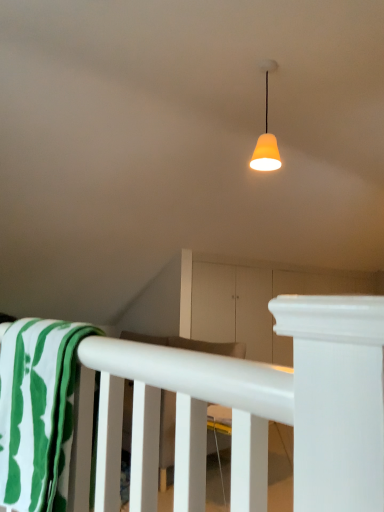
Locate an element on the screen. The image size is (384, 512). white matte rail at lower center is located at coordinates (256, 410).

The image size is (384, 512). What do you see at coordinates (38, 411) in the screenshot? I see `green striped fabric at lower left` at bounding box center [38, 411].

This screenshot has height=512, width=384. Describe the element at coordinates (266, 135) in the screenshot. I see `matte orange lampshade at upper center` at that location.

Where is `white matte rail at lower center`? This screenshot has height=512, width=384. white matte rail at lower center is located at coordinates (256, 410).

From the image's perspective, which is above, matte orange lampshade at upper center or green striped fabric at lower left?

matte orange lampshade at upper center is shown above in the image.

Identify the location of lamp on the right of green striped fabric at lower left. (266, 135).

Is green striped fabric at lower left at the back of matte orange lampshade at upper center?

That's not correct — matte orange lampshade at upper center is not looking away from green striped fabric at lower left.

Is the position of matte orange lampshade at upper center more distant than that of green striped fabric at lower left?

That is True.

In the image, there is a green striped fabric at lower left. Identify the location of rail below it (from the image's perspective). (256, 410).

From a real-world perspective, is white matte rail at lower center over green striped fabric at lower left?

No, from a real-world perspective, white matte rail at lower center is not over green striped fabric at lower left

Is white matte rail at lower center at the right side of green striped fabric at lower left?

Yes.

Is the position of white matte rail at lower center less distant than that of green striped fabric at lower left?

No, white matte rail at lower center is further to the viewer.

Could you tell me if white matte rail at lower center is turned towards matte orange lampshade at upper center?

No, white matte rail at lower center is not turned towards matte orange lampshade at upper center.

Relative to matte orange lampshade at upper center, is white matte rail at lower center in front or behind?

white matte rail at lower center is in front of matte orange lampshade at upper center.

Considering the sizes of objects white matte rail at lower center and matte orange lampshade at upper center in the image provided, who is bigger, white matte rail at lower center or matte orange lampshade at upper center?

Bigger between the two is white matte rail at lower center.

What's the angular difference between white matte rail at lower center and matte orange lampshade at upper center's facing directions?

178 degrees.

Does point (54, 384) lie in front of point (327, 341)?

That is False.

Looking at this image, is green striped fabric at lower left oriented towards white matte rail at lower center?

No, green striped fabric at lower left is not aimed at white matte rail at lower center.

Does green striped fabric at lower left contain white matte rail at lower center?

That's incorrect, white matte rail at lower center is not inside green striped fabric at lower left.

From the image's perspective, relative to white matte rail at lower center, is green striped fabric at lower left above or below?

Based on their image positions, green striped fabric at lower left is located above white matte rail at lower center.

Considering the positions of objects matte orange lampshade at upper center and white matte rail at lower center in the image provided, who is more to the right, matte orange lampshade at upper center or white matte rail at lower center?

Positioned to the right is white matte rail at lower center.

Considering the relative sizes of matte orange lampshade at upper center and white matte rail at lower center in the image provided, is matte orange lampshade at upper center taller than white matte rail at lower center?

Yes.

Consider the image. From a real-world perspective, is matte orange lampshade at upper center under white matte rail at lower center?

No, from a real-world perspective, matte orange lampshade at upper center is not below white matte rail at lower center.

Between matte orange lampshade at upper center and white matte rail at lower center, which one has smaller width?

Thinner between the two is matte orange lampshade at upper center.

Is green striped fabric at lower left located outside matte orange lampshade at upper center?

That's correct, green striped fabric at lower left is outside of matte orange lampshade at upper center.

Which of these two, green striped fabric at lower left or matte orange lampshade at upper center, is wider?

green striped fabric at lower left.

Looking at this image, from the image's perspective, is green striped fabric at lower left positioned above or below matte orange lampshade at upper center?

green striped fabric at lower left is situated lower than matte orange lampshade at upper center in the image.

Is green striped fabric at lower left in front of or behind matte orange lampshade at upper center in the image?

Visually, green striped fabric at lower left is located in front of matte orange lampshade at upper center.

You are a GUI agent. You are given a task and a screenshot of the screen. Output one action in this format:
    pyautogui.click(x=<x>, y=<y>)
    Task: Click on the lamp on the right side of green striped fabric at lower left
    The width and height of the screenshot is (384, 512).
    Given the screenshot: What is the action you would take?
    pyautogui.click(x=266, y=135)

Find the location of a particular element. Image resolution: width=384 pixels, height=512 pixels. beach towel in front of the white matte rail at lower center is located at coordinates (38, 411).

Considering their positions, is white matte rail at lower center positioned further to green striped fabric at lower left than matte orange lampshade at upper center?

The object further to green striped fabric at lower left is matte orange lampshade at upper center.

Estimate the real-world distances between objects in this image. Which object is closer to matte orange lampshade at upper center, white matte rail at lower center or green striped fabric at lower left?

green striped fabric at lower left lies closer to matte orange lampshade at upper center than the other object.

Considering their positions, is matte orange lampshade at upper center positioned further to green striped fabric at lower left than white matte rail at lower center?

matte orange lampshade at upper center is further to green striped fabric at lower left.

From the image, which object appears to be farther from white matte rail at lower center, green striped fabric at lower left or matte orange lampshade at upper center?

matte orange lampshade at upper center.

From the picture: Based on their spatial positions, is green striped fabric at lower left or white matte rail at lower center closer to matte orange lampshade at upper center?

green striped fabric at lower left lies closer to matte orange lampshade at upper center than the other object.

Which object lies nearer to the anchor point white matte rail at lower center, matte orange lampshade at upper center or green striped fabric at lower left?

Based on the image, green striped fabric at lower left appears to be nearer to white matte rail at lower center.

The image size is (384, 512). In order to click on beach towel between matte orange lampshade at upper center and white matte rail at lower center vertically in this screenshot , I will do `click(38, 411)`.